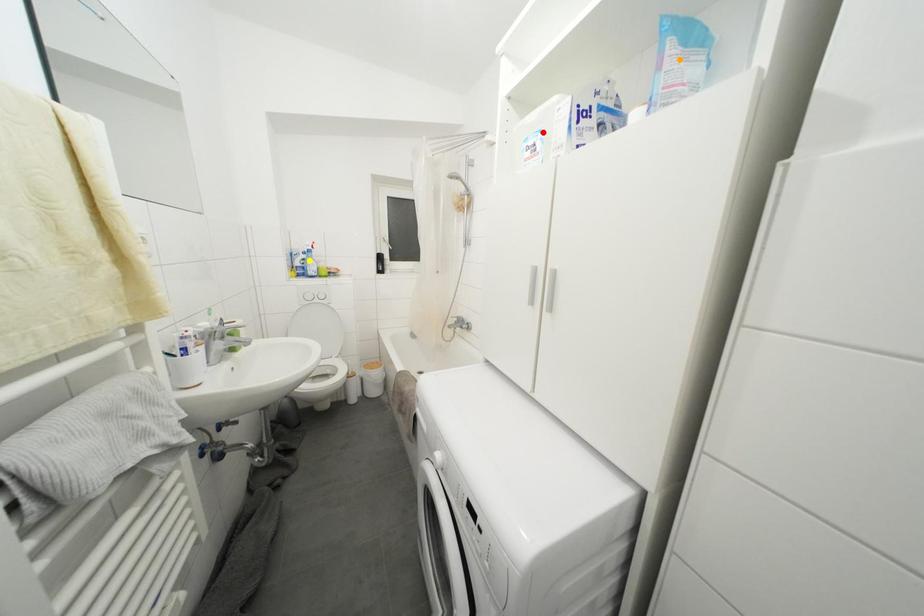
Order these from farthest to nearest:
orange point
red point
yellow point

yellow point
red point
orange point